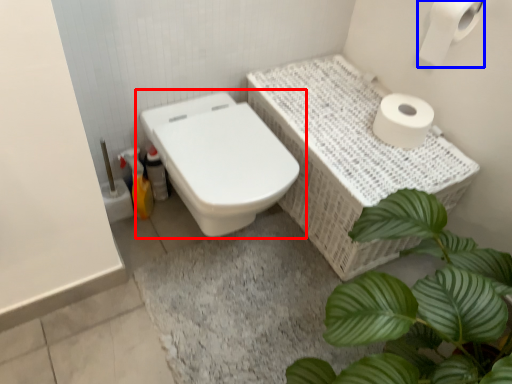
Question: Among these objects, which one is farthest to the camera, toilet (highlighted by a red box) or toilet paper (highlighted by a blue box)?

Choices:
 (A) toilet
 (B) toilet paper

Answer: (A)